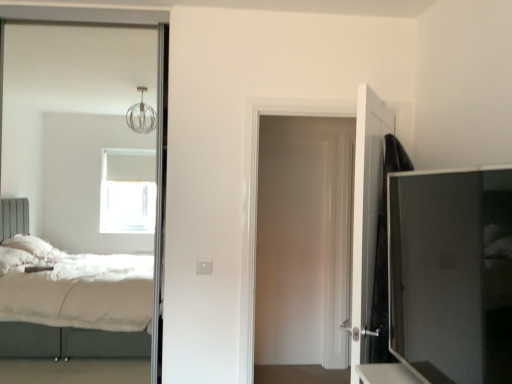
Question: Considering the relative positions of black matte door at right, which ranks as the 1th door in front-to-back order, and matte black tv cabinet at right in the image provided, is black matte door at right, which ranks as the 1th door in front-to-back order, to the right of matte black tv cabinet at right from the viewer's perspective?

Choices:
 (A) yes
 (B) no

Answer: (A)

Question: From a real-world perspective, is black matte door at right, which ranks as the 1th door in front-to-back order, over matte black tv cabinet at right?

Choices:
 (A) yes
 (B) no

Answer: (B)

Question: From the image's perspective, is black matte door at right, marked as the 2th door in a back-to-front arrangement, below matte black tv cabinet at right?

Choices:
 (A) yes
 (B) no

Answer: (A)

Question: Can you confirm if black matte door at right, marked as the 2th door in a back-to-front arrangement, is bigger than matte black tv cabinet at right?

Choices:
 (A) yes
 (B) no

Answer: (A)

Question: Considering the relative sizes of black matte door at right, which ranks as the 1th door in front-to-back order, and matte black tv cabinet at right in the image provided, is black matte door at right, which ranks as the 1th door in front-to-back order, thinner than matte black tv cabinet at right?

Choices:
 (A) yes
 (B) no

Answer: (B)

Question: Considering the positions of white glossy door at center, which is counted as the first door, starting from the back, and matte black tv cabinet at right in the image, is white glossy door at center, which is counted as the first door, starting from the back, taller or shorter than matte black tv cabinet at right?

Choices:
 (A) short
 (B) tall

Answer: (B)

Question: From a real-world perspective, relative to matte black tv cabinet at right, is white glossy door at center, positioned as the 2th door in front-to-back order, vertically above or below?

Choices:
 (A) above
 (B) below

Answer: (B)

Question: Considering the relative positions of white glossy door at center, which is counted as the first door, starting from the back, and matte black tv cabinet at right in the image provided, is white glossy door at center, which is counted as the first door, starting from the back, to the left or to the right of matte black tv cabinet at right?

Choices:
 (A) right
 (B) left

Answer: (B)

Question: Considering their positions, is white glossy door at center, positioned as the 2th door in front-to-back order, located in front of or behind matte black tv cabinet at right?

Choices:
 (A) behind
 (B) front

Answer: (A)

Question: Considering their positions, is matte black tv cabinet at right located in front of or behind black matte door at right, which ranks as the 1th door in front-to-back order?

Choices:
 (A) front
 (B) behind

Answer: (A)

Question: From a real-world perspective, is matte black tv cabinet at right above or below black matte door at right, which ranks as the 1th door in front-to-back order?

Choices:
 (A) above
 (B) below

Answer: (A)

Question: Looking at the image, does matte black tv cabinet at right seem bigger or smaller compared to black matte door at right, marked as the 2th door in a back-to-front arrangement?

Choices:
 (A) big
 (B) small

Answer: (B)

Question: Is point (406, 200) positioned closer to the camera than point (379, 129)?

Choices:
 (A) farther
 (B) closer

Answer: (B)

Question: Based on their sizes in the image, would you say white glossy door at center, positioned as the 2th door in front-to-back order, is bigger or smaller than black matte door at right, which ranks as the 1th door in front-to-back order?

Choices:
 (A) small
 (B) big

Answer: (A)

Question: Is white glossy door at center, positioned as the 2th door in front-to-back order, wider or thinner than black matte door at right, marked as the 2th door in a back-to-front arrangement?

Choices:
 (A) thin
 (B) wide

Answer: (A)